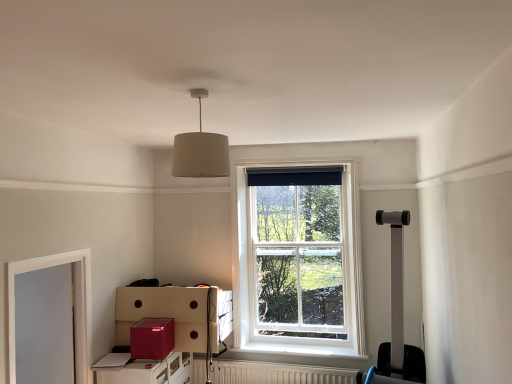
Question: From the image's perspective, relative to white wood frame at left, is glossy cardboard box at lower left above or below?

Choices:
 (A) above
 (B) below

Answer: (B)

Question: In the image, is glossy cardboard box at lower left positioned in front of or behind white wood frame at left?

Choices:
 (A) front
 (B) behind

Answer: (B)

Question: Estimate the real-world distances between objects in this image. Which object is closer to the glossy cardboard box at lower left?

Choices:
 (A) metallic red file cabinet at lower left
 (B) white wooden window at center
 (C) white wood frame at left
 (D) dark blue fabric at upper center
 (E) beige fabric lampshade at upper center

Answer: (A)

Question: Estimate the real-world distances between objects in this image. Which object is closer to the beige fabric lampshade at upper center?

Choices:
 (A) glossy cardboard box at lower left
 (B) white wooden window at center
 (C) dark blue fabric at upper center
 (D) white textured radiator at lower center
 (E) metallic red file cabinet at lower left

Answer: (A)